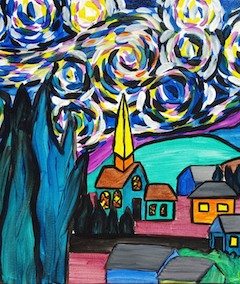
This screenshot has width=240, height=284. I want to click on yellow windows, so click(204, 210), click(222, 208).